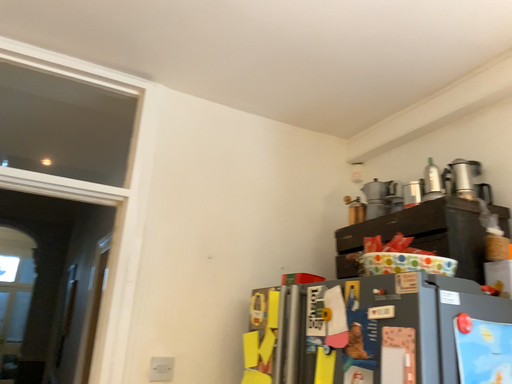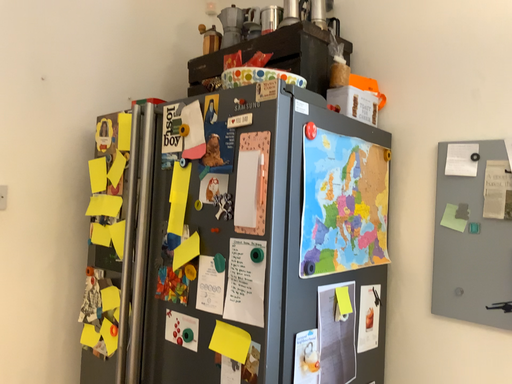
Question: How did the camera likely rotate when shooting the video?

Choices:
 (A) rotated right
 (B) rotated left

Answer: (A)